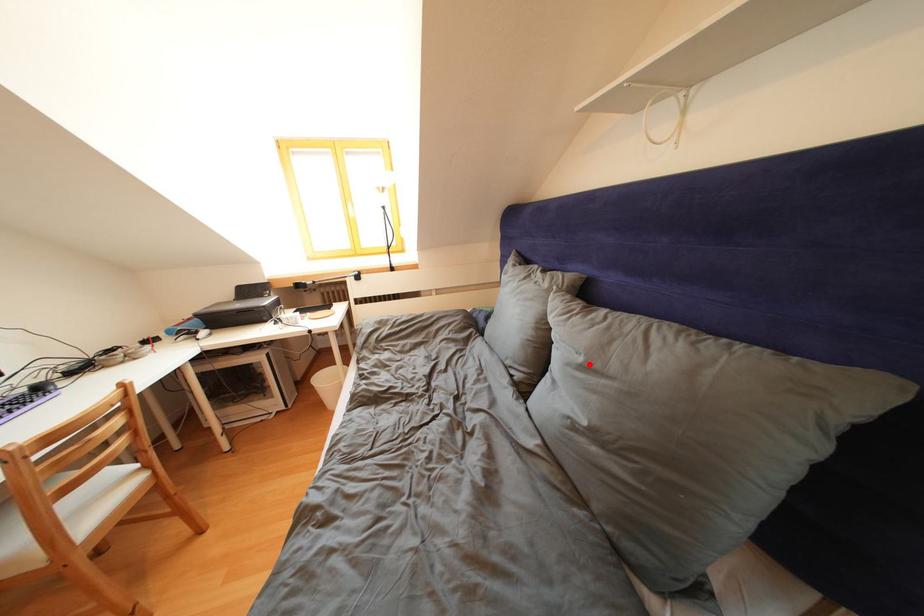
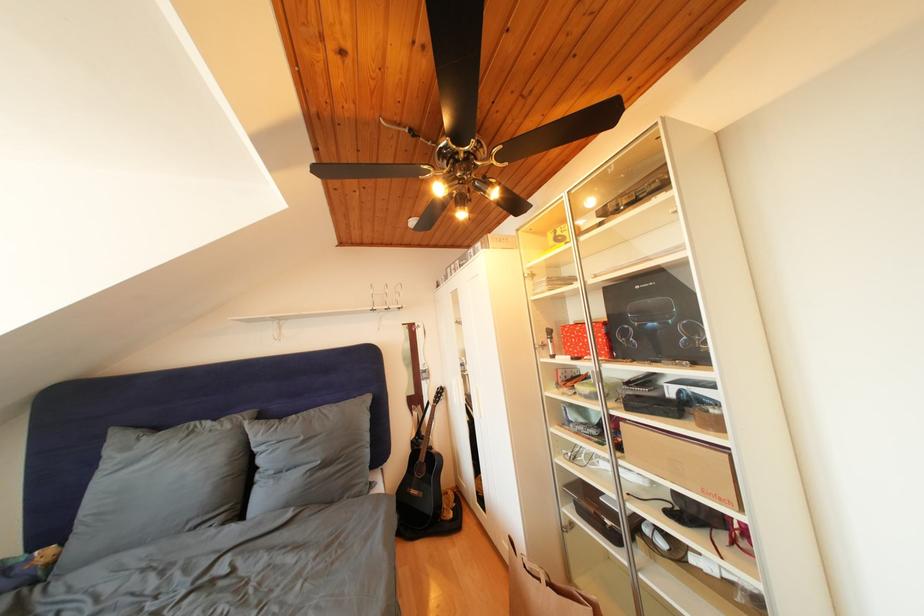
Question: I am providing you with two images of the same scene from different viewpoints. A red point is marked on the first image. Is the red point's position out of view in image 2?

Choices:
 (A) Yes
 (B) No

Answer: (B)